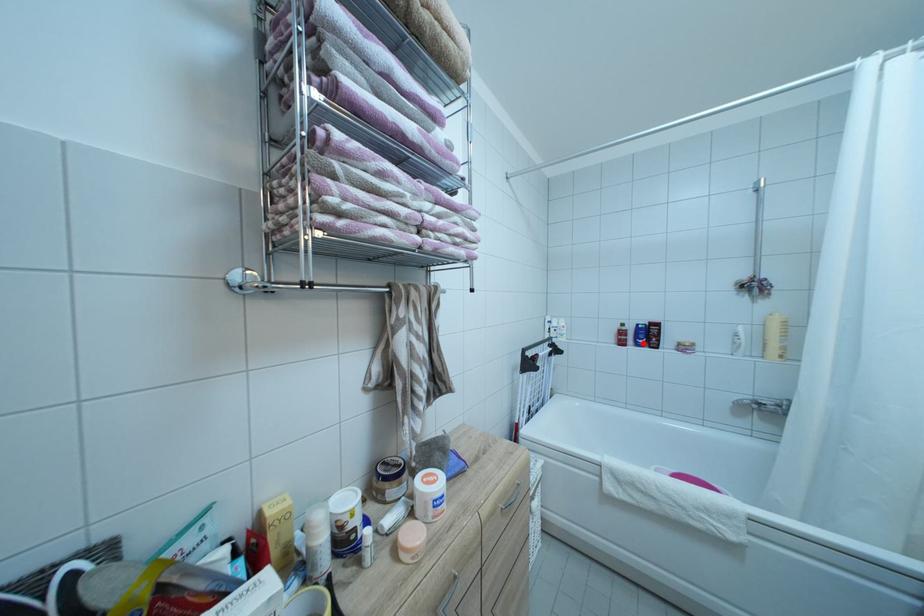
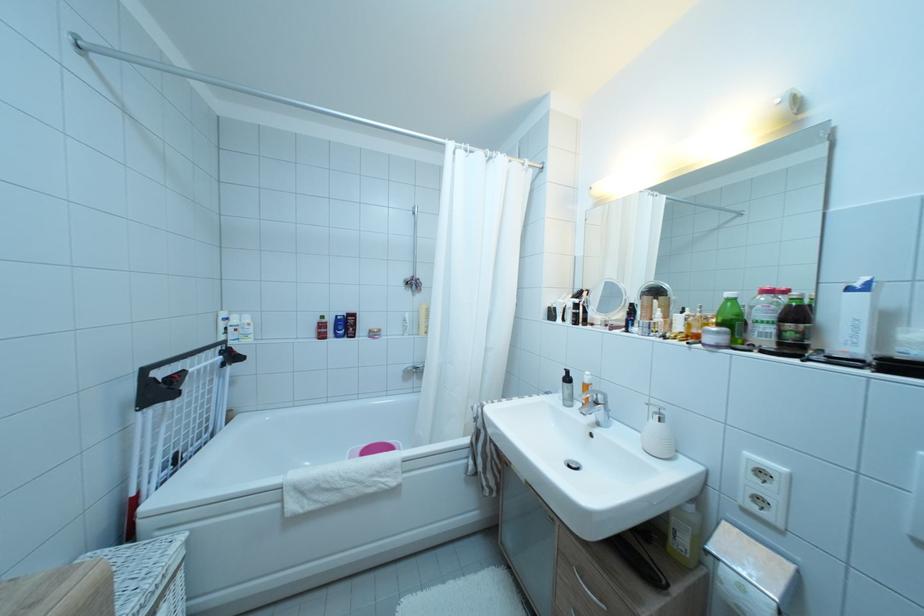
The point at the highlighted location is marked in the first image. Where is the corresponding point in the second image?

(343, 334)